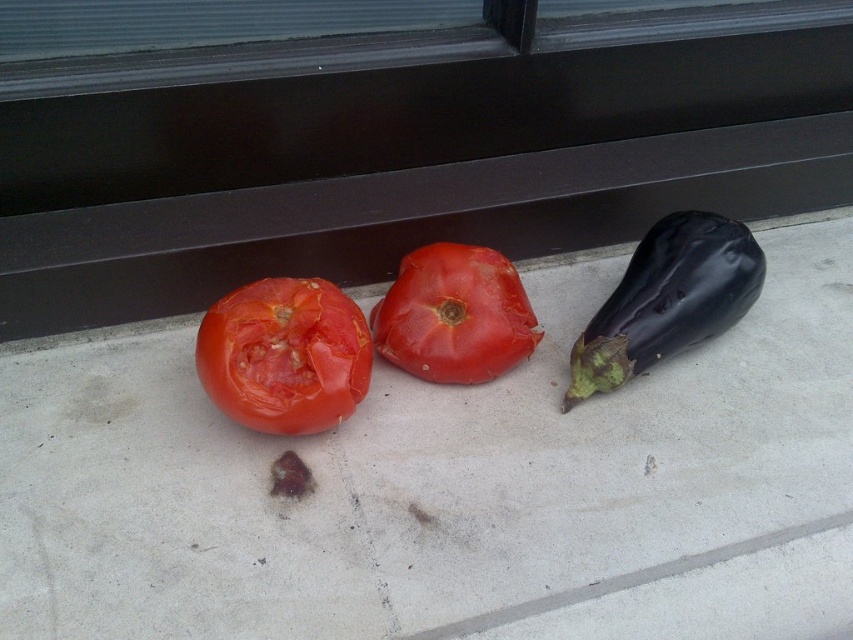
Between concrete at center and matte red tomato at center, which one is positioned higher?

Positioned higher is concrete at center.

Does point (341, 72) come behind point (374, 321)?

No, it is in front of (374, 321).

At what (x,y) coordinates should I click in order to perform the action: click on concrete at center. Please return your answer as a coordinate pair (x, y). The width and height of the screenshot is (853, 640). Looking at the image, I should click on (405, 148).

Which is above, concrete at center or shiny dark purple eggplant at right?

concrete at center is above.

Between concrete at center and shiny dark purple eggplant at right, which one appears on the right side from the viewer's perspective?

shiny dark purple eggplant at right

Locate an element on the screen. The height and width of the screenshot is (640, 853). concrete at center is located at coordinates (405, 148).

Who is higher up, shiny red tomato at center or matte red tomato at center?

matte red tomato at center is above.

Does shiny red tomato at center appear under matte red tomato at center?

Yes, shiny red tomato at center is below matte red tomato at center.

Locate an element on the screen. shiny red tomato at center is located at coordinates [x=283, y=355].